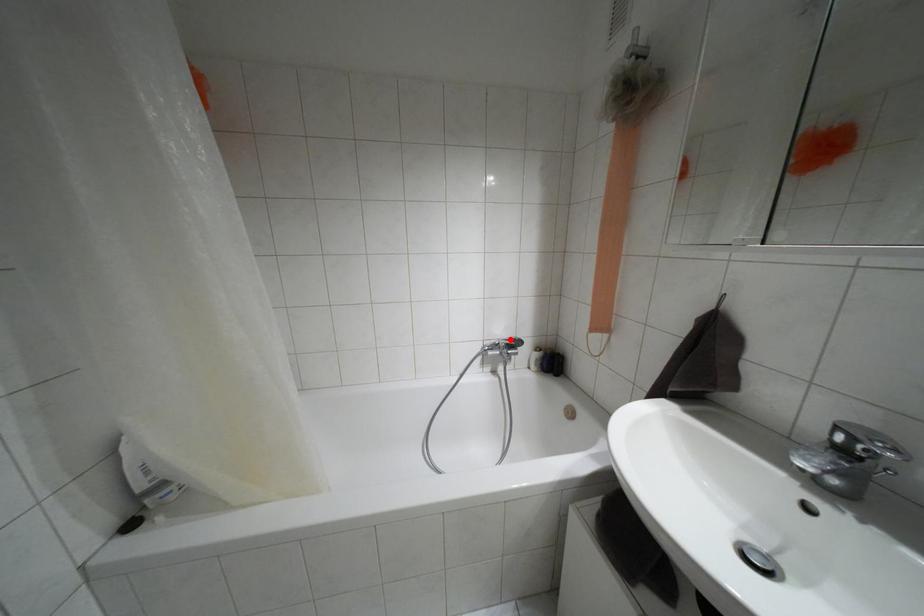
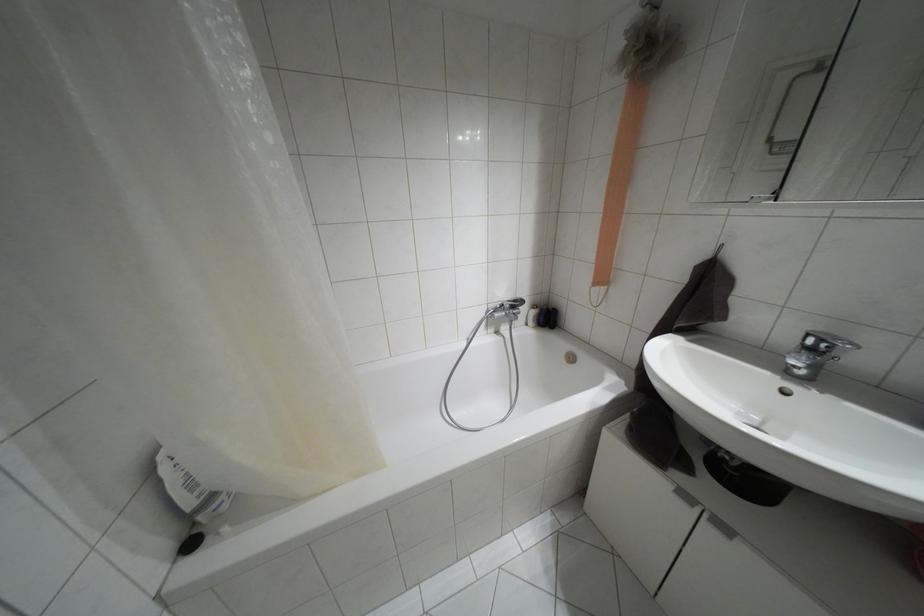
Find the pixel in the second image that matches the highlighted location in the first image.

(514, 301)